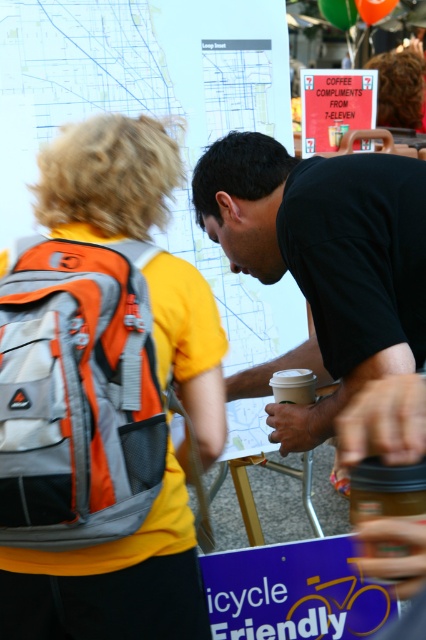
Is white paper map at upper left bigger than white matte cup at center?

Indeed, white paper map at upper left has a larger size compared to white matte cup at center.

Is point (193, 250) behind point (275, 400)?

Yes, point (193, 250) is behind point (275, 400).

In order to click on white paper map at upper left in this screenshot , I will do `click(157, 116)`.

Between orange fabric backpack at upper left and white paper map at upper left, which one has less height?

With less height is orange fabric backpack at upper left.

Does orange fabric backpack at upper left come in front of white paper map at upper left?

Yes.

This screenshot has width=426, height=640. What do you see at coordinates (103, 397) in the screenshot?
I see `orange fabric backpack at upper left` at bounding box center [103, 397].

Locate an element on the screen. The height and width of the screenshot is (640, 426). orange fabric backpack at upper left is located at coordinates (103, 397).

From the picture: Can you confirm if orange fabric backpack at upper left is positioned above black matte shirt at center?

Incorrect, orange fabric backpack at upper left is not positioned above black matte shirt at center.

Is orange fabric backpack at upper left to the left of black matte shirt at center from the viewer's perspective?

Indeed, orange fabric backpack at upper left is positioned on the left side of black matte shirt at center.

Describe the element at coordinates (103, 397) in the screenshot. I see `orange fabric backpack at upper left` at that location.

Where is `orange fabric backpack at upper left`? The image size is (426, 640). orange fabric backpack at upper left is located at coordinates (103, 397).